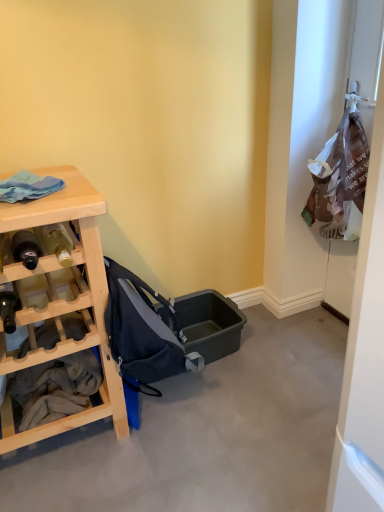
Where is `free point above natural wood desk at left (from a real-world perspective)`? free point above natural wood desk at left (from a real-world perspective) is located at coordinates (49, 189).